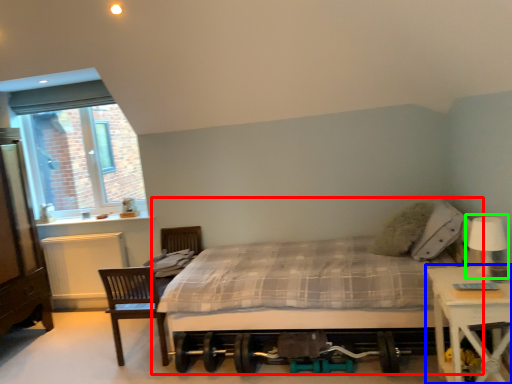
Question: Based on their relative distances, which object is farther from bed (highlighted by a red box)? Choose from nightstand (highlighted by a blue box) and table lamp (highlighted by a green box).

Choices:
 (A) nightstand
 (B) table lamp

Answer: (B)